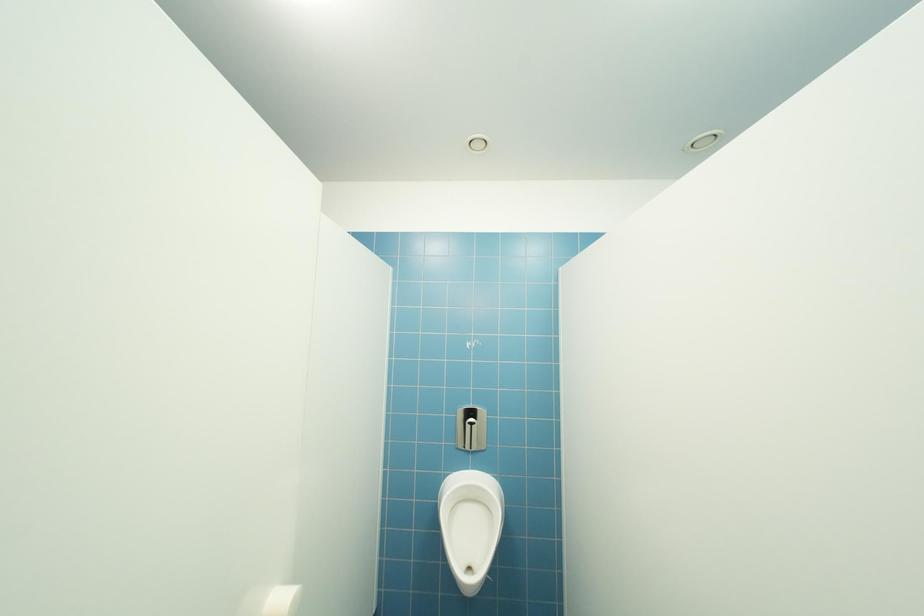
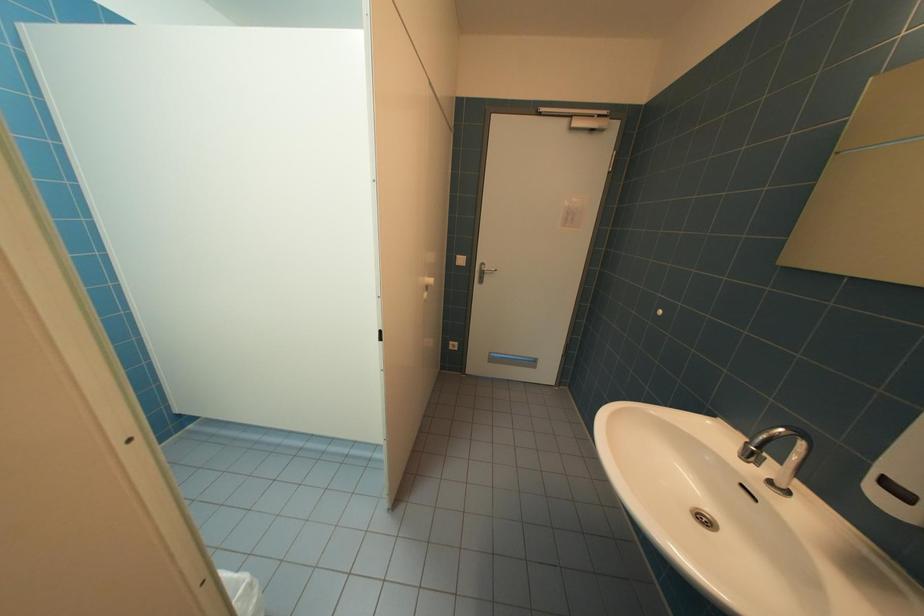
The images are taken continuously from a first-person perspective. In which direction is your viewpoint rotating?

The camera rotated toward right-down.